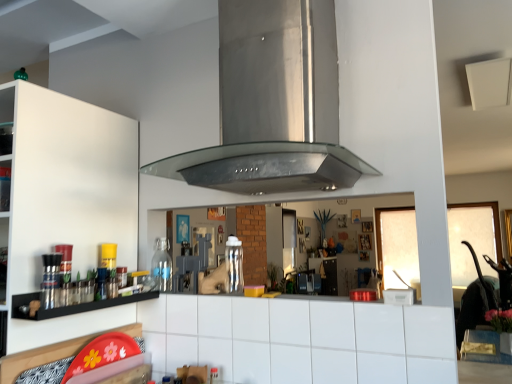
What do you see at coordinates (72, 305) in the screenshot? I see `black glass shelf at left` at bounding box center [72, 305].

Identify the location of white matte cabinet at left. (66, 185).

At what (x,y) coordinates should I click in order to perform the action: click on clear plastic bottle at center, arranged as the second bottle when viewed from the left. Please return your answer as a coordinate pair (x, y). The width and height of the screenshot is (512, 384). Looking at the image, I should click on (234, 265).

From a real-world perspective, who is located higher, black glass shelf at left or white tile counter at center?

In real-world perspective, black glass shelf at left is above.

Locate an element on the screen. This screenshot has height=384, width=512. counter top below the black glass shelf at left (from a real-world perspective) is located at coordinates (300, 339).

From a real-world perspective, is white matte cabinet at left located higher than transparent glass bottle at left, which is counted as the 2th bottle, starting from the right?

Yes.

Does point (44, 185) come in front of point (161, 289)?

Yes, it is.

Is white matte cabinet at left to the left of transparent glass bottle at left, marked as the 2th bottle in a front-to-back arrangement, from the viewer's perspective?

Correct, you'll find white matte cabinet at left to the left of transparent glass bottle at left, marked as the 2th bottle in a front-to-back arrangement.

From the image's perspective, is stainless steel vent at center over white matte cabinet at left?

Yes.

Between stainless steel vent at center and white matte cabinet at left, which one is positioned behind?

white matte cabinet at left is further from the camera.

Is stainless steel vent at center next to white matte cabinet at left and touching it?

No, stainless steel vent at center is not next to white matte cabinet at left.

Locate an element on the screen. The image size is (512, 384). cabinetry located in front of the white tile counter at center is located at coordinates (66, 185).

From the image's perspective, which is below, white matte cabinet at left or white tile counter at center?

From the image's view, white tile counter at center is below.

Does point (45, 178) appear closer or farther from the camera than point (202, 319)?

Point (45, 178).

Based on the photo, is white matte cabinet at left behind white tile counter at center?

No.

Is transparent glass bottle at left, the first bottle from the back, outside of clear plastic bottle at center, arranged as the second bottle when viewed from the left?

That's correct, transparent glass bottle at left, the first bottle from the back, is outside of clear plastic bottle at center, arranged as the second bottle when viewed from the left.

From the image's perspective, would you say transparent glass bottle at left, which is counted as the 2th bottle, starting from the right, is shown under clear plastic bottle at center, marked as the 2th bottle in a back-to-front arrangement?

Correct, transparent glass bottle at left, which is counted as the 2th bottle, starting from the right, appears lower than clear plastic bottle at center, marked as the 2th bottle in a back-to-front arrangement, in the image.

Which object is positioned more to the right, transparent glass bottle at left, the 1th bottle from the left, or clear plastic bottle at center, arranged as the second bottle when viewed from the left?

clear plastic bottle at center, arranged as the second bottle when viewed from the left, is more to the right.

Can you tell me how much transparent glass bottle at left, which is counted as the 2th bottle, starting from the right, and clear plastic bottle at center, which ranks as the 1th bottle in right-to-left order, differ in facing direction?

The angular difference between transparent glass bottle at left, which is counted as the 2th bottle, starting from the right, and clear plastic bottle at center, which ranks as the 1th bottle in right-to-left order, is 3.16 degrees.

From the image's perspective, would you say clear plastic bottle at center, which ranks as the 1th bottle in right-to-left order, is shown under black glass shelf at left?

Incorrect, from the image's perspective, clear plastic bottle at center, which ranks as the 1th bottle in right-to-left order, is higher than black glass shelf at left.

From a real-world perspective, is clear plastic bottle at center, the first bottle viewed from the front, above or below black glass shelf at left?

From a real-world perspective, clear plastic bottle at center, the first bottle viewed from the front, is physically above black glass shelf at left.

Choose the correct answer: Is clear plastic bottle at center, arranged as the second bottle when viewed from the left, inside black glass shelf at left or outside it?

clear plastic bottle at center, arranged as the second bottle when viewed from the left, is not enclosed by black glass shelf at left.

From the image's perspective, is white matte cabinet at left positioned above or below stainless steel vent at center?

From the image's perspective, white matte cabinet at left appears below stainless steel vent at center.

Consider the image. Considering the sizes of objects white matte cabinet at left and stainless steel vent at center in the image provided, who is taller, white matte cabinet at left or stainless steel vent at center?

With more height is white matte cabinet at left.

In the image, is white matte cabinet at left positioned in front of or behind stainless steel vent at center?

Visually, white matte cabinet at left is located behind stainless steel vent at center.

From a real-world perspective, which is physically below, white matte cabinet at left or stainless steel vent at center?

white matte cabinet at left, from a real-world perspective.

This screenshot has width=512, height=384. I want to click on shelf that is above the white tile counter at center (from a real-world perspective), so click(x=72, y=305).

Image resolution: width=512 pixels, height=384 pixels. In order to click on cabinetry in front of the transparent glass bottle at left, which is counted as the 2th bottle, starting from the right in this screenshot , I will do `click(66, 185)`.

Considering their positions, is black glass shelf at left positioned closer to clear plastic bottle at center, the first bottle viewed from the front, than white matte cabinet at left?

black glass shelf at left lies closer to clear plastic bottle at center, the first bottle viewed from the front, than the other object.

Looking at the image, which one is located closer to white matte cabinet at left, clear plastic bottle at center, marked as the 2th bottle in a back-to-front arrangement, or white tile counter at center?

Among the two, white tile counter at center is located nearer to white matte cabinet at left.

From the image, which object appears to be farther from stainless steel vent at center, transparent glass bottle at left, marked as the 2th bottle in a front-to-back arrangement, or black glass shelf at left?

black glass shelf at left is positioned further to the anchor stainless steel vent at center.

Estimate the real-world distances between objects in this image. Which object is closer to white matte cabinet at left, white tile counter at center or clear plastic bottle at center, which ranks as the 1th bottle in right-to-left order?

white tile counter at center.

Which object lies further to the anchor point stainless steel vent at center, white matte cabinet at left or white tile counter at center?

The object further to stainless steel vent at center is white tile counter at center.

Based on their spatial positions, is transparent glass bottle at left, the 1th bottle from the left, or clear plastic bottle at center, which ranks as the 1th bottle in right-to-left order, further from white matte cabinet at left?

Among the two, clear plastic bottle at center, which ranks as the 1th bottle in right-to-left order, is located further to white matte cabinet at left.

Based on their spatial positions, is stainless steel vent at center or white tile counter at center further from white matte cabinet at left?

stainless steel vent at center lies further to white matte cabinet at left than the other object.

Consider the image. When comparing their distances from transparent glass bottle at left, marked as the 2th bottle in a front-to-back arrangement, does stainless steel vent at center or white matte cabinet at left seem closer?

Based on the image, white matte cabinet at left appears to be nearer to transparent glass bottle at left, marked as the 2th bottle in a front-to-back arrangement.

The image size is (512, 384). Identify the location of bottle positioned between black glass shelf at left and transparent glass bottle at left, the first bottle from the back, from near to far. (234, 265).

Image resolution: width=512 pixels, height=384 pixels. I want to click on shelf between white matte cabinet at left and transparent glass bottle at left, the first bottle from the back, in the front-back direction, so click(x=72, y=305).

Identify the location of shelf located between white matte cabinet at left and stainless steel vent at center in the left-right direction. The image size is (512, 384). point(72,305).

Identify the location of shelf located between stainless steel vent at center and transparent glass bottle at left, the first bottle from the back, in the depth direction. The height and width of the screenshot is (384, 512). (72, 305).